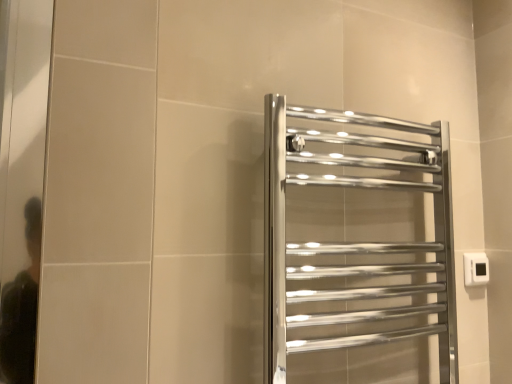
Question: Is point (480, 276) closer or farther from the camera than point (410, 291)?

Choices:
 (A) closer
 (B) farther

Answer: (B)

Question: Is white plastic electric outlet at right in front of or behind polished chrome towel rack at center in the image?

Choices:
 (A) front
 (B) behind

Answer: (B)

Question: Is white plastic electric outlet at right wider or thinner than polished chrome towel rack at center?

Choices:
 (A) wide
 (B) thin

Answer: (B)

Question: Considering their positions, is polished chrome towel rack at center located in front of or behind white plastic electric outlet at right?

Choices:
 (A) front
 (B) behind

Answer: (A)

Question: Is polished chrome towel rack at center inside or outside of white plastic electric outlet at right?

Choices:
 (A) outside
 (B) inside

Answer: (A)

Question: Is point (266, 347) closer or farther from the camera than point (464, 271)?

Choices:
 (A) closer
 (B) farther

Answer: (A)

Question: From the image's perspective, is polished chrome towel rack at center above or below white plastic electric outlet at right?

Choices:
 (A) above
 (B) below

Answer: (A)